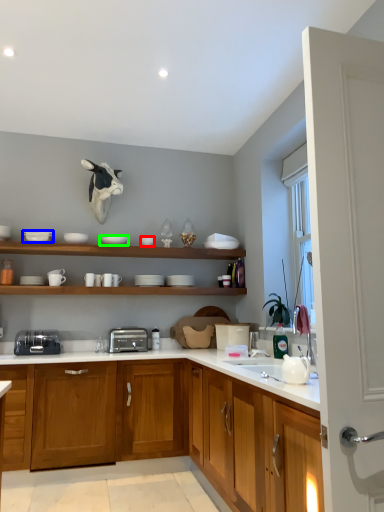
Question: Based on their relative distances, which object is farther from tableware (highlighted by a red box)? Choose from tableware (highlighted by a blue box) and tableware (highlighted by a green box).

Choices:
 (A) tableware
 (B) tableware

Answer: (A)